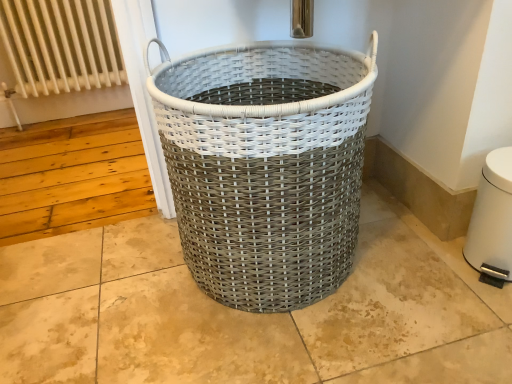
Question: Is white woven basket at center further to camera compared to white metal radiator at upper left?

Choices:
 (A) no
 (B) yes

Answer: (A)

Question: Is white woven basket at center oriented towards white metal radiator at upper left?

Choices:
 (A) yes
 (B) no

Answer: (B)

Question: Is white woven basket at center at the right side of white metal radiator at upper left?

Choices:
 (A) no
 (B) yes

Answer: (B)

Question: From a real-world perspective, is white woven basket at center located higher than white metal radiator at upper left?

Choices:
 (A) yes
 (B) no

Answer: (A)

Question: Would you consider white woven basket at center to be distant from white metal radiator at upper left?

Choices:
 (A) no
 (B) yes

Answer: (B)

Question: From a real-world perspective, is white metal radiator at upper left above or below white plastic water heater at lower right?

Choices:
 (A) below
 (B) above

Answer: (B)

Question: Relative to white plastic water heater at lower right, is white metal radiator at upper left in front or behind?

Choices:
 (A) front
 (B) behind

Answer: (B)

Question: Is white metal radiator at upper left spatially inside white plastic water heater at lower right, or outside of it?

Choices:
 (A) inside
 (B) outside

Answer: (B)

Question: Is point (35, 41) positioned closer to the camera than point (507, 157)?

Choices:
 (A) farther
 (B) closer

Answer: (A)

Question: Considering the positions of white woven basket at center and white metal radiator at upper left in the image, is white woven basket at center taller or shorter than white metal radiator at upper left?

Choices:
 (A) short
 (B) tall

Answer: (A)

Question: Is white woven basket at center to the left or to the right of white metal radiator at upper left in the image?

Choices:
 (A) left
 (B) right

Answer: (B)

Question: From a real-world perspective, relative to white metal radiator at upper left, is white woven basket at center vertically above or below?

Choices:
 (A) below
 (B) above

Answer: (B)

Question: Is white woven basket at center situated inside white metal radiator at upper left or outside?

Choices:
 (A) inside
 (B) outside

Answer: (B)

Question: In terms of height, does white plastic water heater at lower right look taller or shorter compared to white metal radiator at upper left?

Choices:
 (A) short
 (B) tall

Answer: (A)

Question: Is white plastic water heater at lower right in front of or behind white metal radiator at upper left in the image?

Choices:
 (A) front
 (B) behind

Answer: (A)